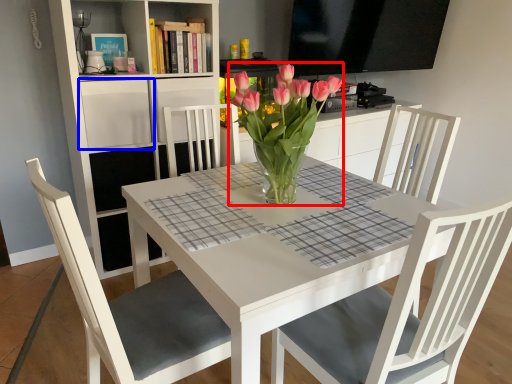
Question: Which object is closer to the camera taking this photo, floral arrangement (highlighted by a red box) or shelf (highlighted by a blue box)?

Choices:
 (A) floral arrangement
 (B) shelf

Answer: (A)